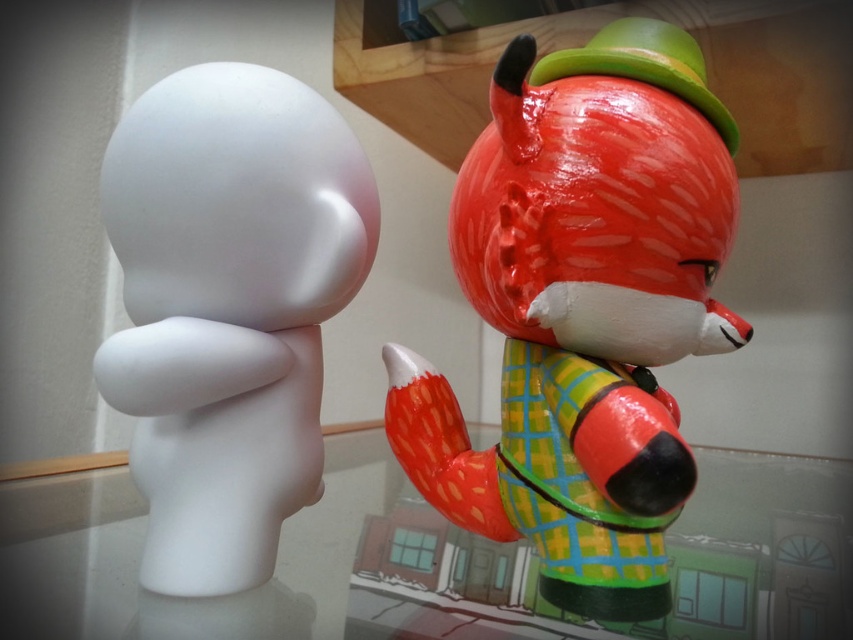
Is shiny red fox at right taller than matte white figure at left?

Indeed, shiny red fox at right has a greater height compared to matte white figure at left.

Between shiny red fox at right and matte white figure at left, which one is positioned higher?

Positioned higher is shiny red fox at right.

Find the location of a particular element. shiny red fox at right is located at coordinates (582, 310).